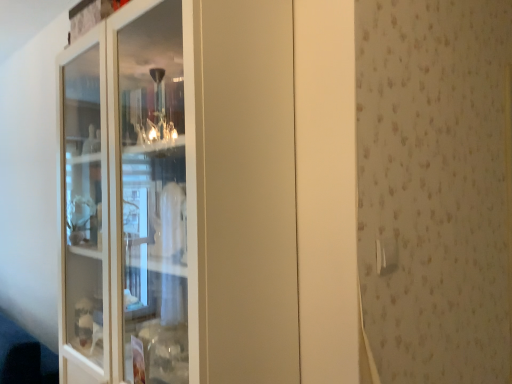
Question: Is white plastic door handle at upper right inside the boundaries of white glass cabinet at left, or outside?

Choices:
 (A) inside
 (B) outside

Answer: (B)

Question: Is white plastic door handle at upper right in front of or behind white glass cabinet at left in the image?

Choices:
 (A) behind
 (B) front

Answer: (A)

Question: Looking at the image, does white plastic door handle at upper right seem bigger or smaller compared to white glass cabinet at left?

Choices:
 (A) big
 (B) small

Answer: (B)

Question: Choose the correct answer: Is white glass cabinet at left inside white plastic door handle at upper right or outside it?

Choices:
 (A) inside
 (B) outside

Answer: (B)

Question: Would you say white glass cabinet at left is to the left or to the right of white plastic door handle at upper right in the picture?

Choices:
 (A) left
 (B) right

Answer: (A)

Question: From their relative heights in the image, would you say white glass cabinet at left is taller or shorter than white plastic door handle at upper right?

Choices:
 (A) short
 (B) tall

Answer: (B)

Question: In terms of width, does white glass cabinet at left look wider or thinner when compared to white plastic door handle at upper right?

Choices:
 (A) thin
 (B) wide

Answer: (B)